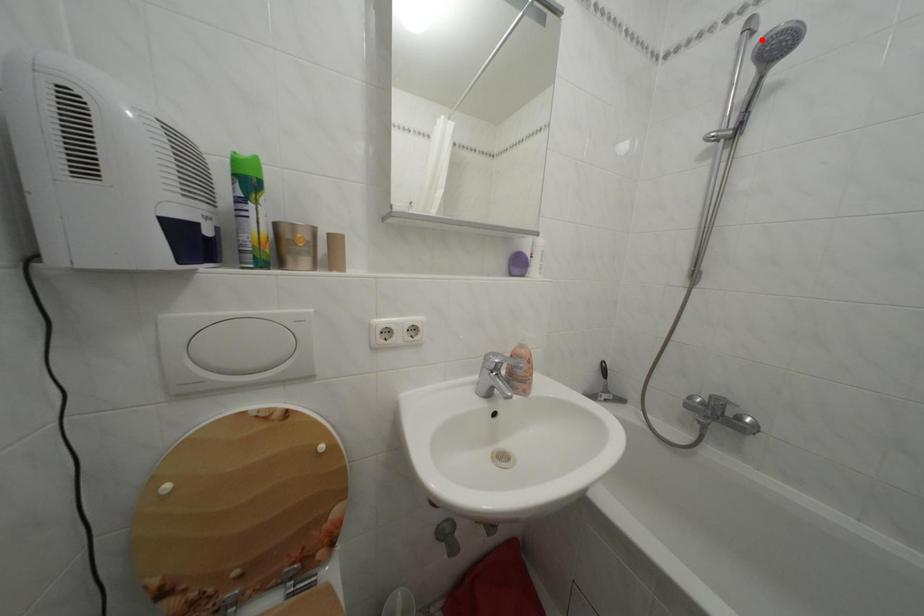
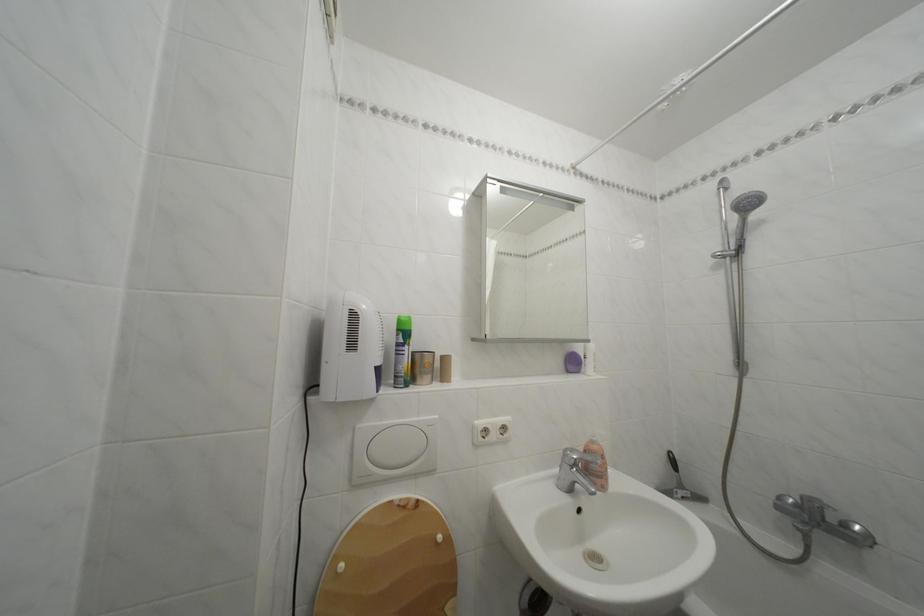
Find the pixel in the second image that matches the highlighted location in the first image.

(736, 195)